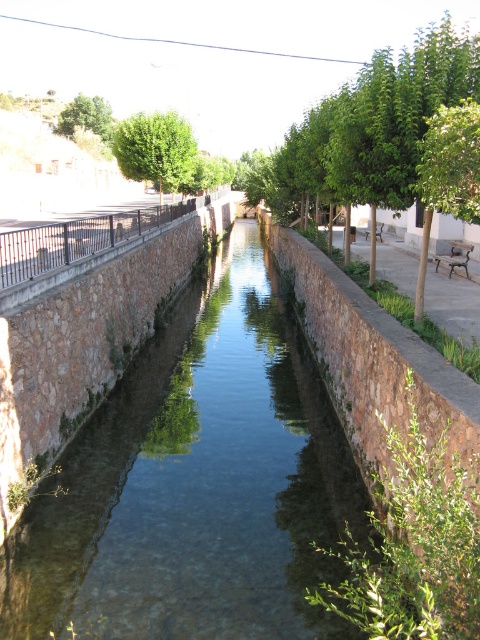
Can you confirm if clear stone stream at center is wider than green leafy tree at upper center?

No, clear stone stream at center is not wider than green leafy tree at upper center.

Where is `clear stone stream at center`? clear stone stream at center is located at coordinates (195, 483).

Identify the location of clear stone stream at center. (195, 483).

Is clear stone stream at center taller than green leafy tree at center?

Incorrect, clear stone stream at center's height is not larger of green leafy tree at center's.

Does clear stone stream at center appear over green leafy tree at center?

Actually, clear stone stream at center is below green leafy tree at center.

The image size is (480, 640). What are the coordinates of `clear stone stream at center` in the screenshot? It's located at (195, 483).

Where is `clear stone stream at center`? The image size is (480, 640). clear stone stream at center is located at coordinates (195, 483).

Is green leafy tree at center taller than green leafy tree at upper left?

Yes.

What do you see at coordinates (372, 132) in the screenshot?
I see `green leafy tree at center` at bounding box center [372, 132].

Locate an element on the screen. This screenshot has height=640, width=480. green leafy tree at center is located at coordinates (372, 132).